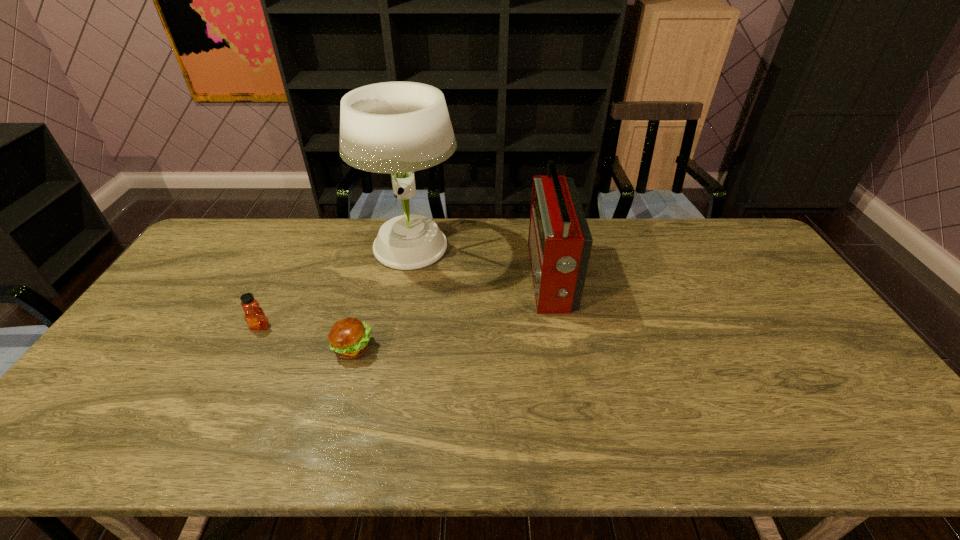
Locate an element on the screen. The height and width of the screenshot is (540, 960). lamp is located at coordinates (397, 128).

This screenshot has height=540, width=960. In order to click on the rightmost object in this screenshot , I will do `click(559, 241)`.

What are the coordinates of `radio receiver` in the screenshot? It's located at (559, 241).

Image resolution: width=960 pixels, height=540 pixels. Find the location of `the third tallest object`. the third tallest object is located at coordinates (255, 317).

Locate an element on the screen. the leftmost object is located at coordinates (255, 317).

Locate an element on the screen. The image size is (960, 540). the shortest object is located at coordinates (349, 337).

You are a GUI agent. You are given a task and a screenshot of the screen. Output one action in this format:
    pyautogui.click(x=<x>, y=<y>)
    Task: Click on the free location located 0.310m on the front-facing side of the lamp
    
    Given the screenshot: What is the action you would take?
    pyautogui.click(x=550, y=249)

Locate an element on the screen. free spot located on the front-facing side of the radio receiver is located at coordinates (410, 278).

Identify the location of free space located 0.120m on the front-facing side of the radio receiver. (492, 278).

At what (x,y) coordinates should I click in order to perform the action: click on vacant area located on the front-facing side of the radio receiver. Please return your answer as a coordinate pair (x, y). Looking at the image, I should click on coord(410,278).